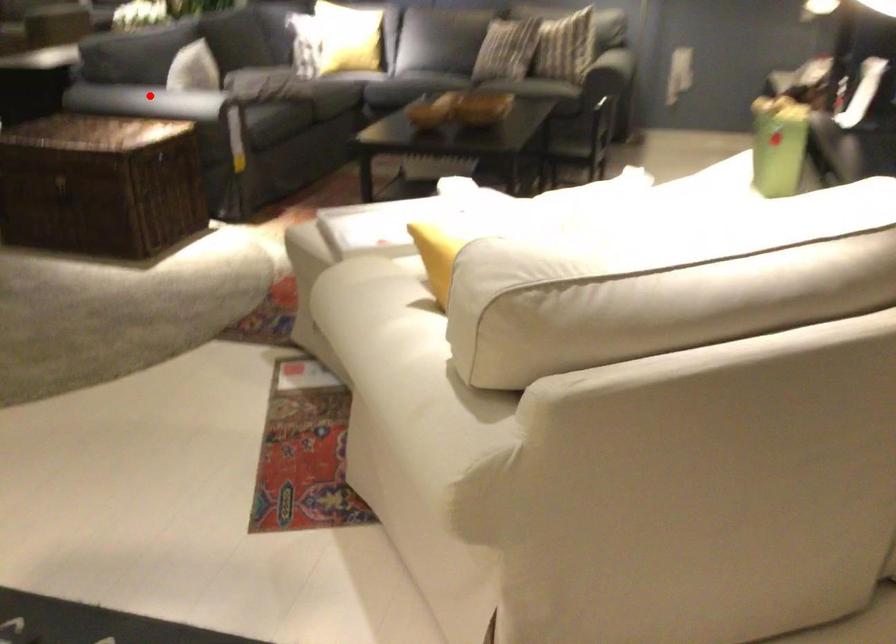
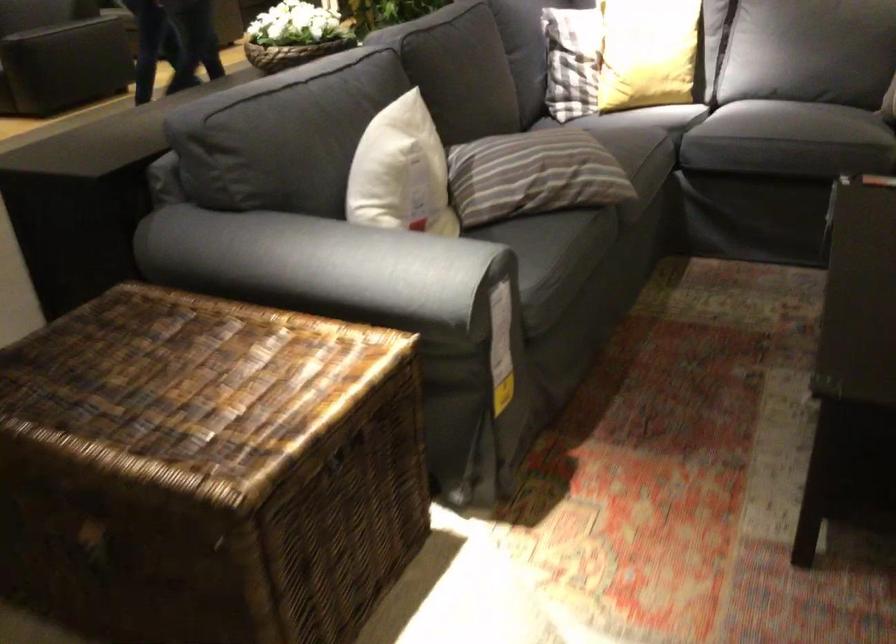
Question: I am providing you with two images of the same scene from different viewpoints. Given a red point in image1, look at the same physical point in image2. Is it:

Choices:
 (A) Closer to the viewpoint
 (B) Farther from the viewpoint

Answer: (A)